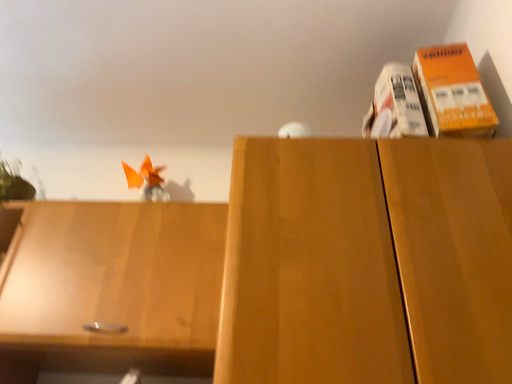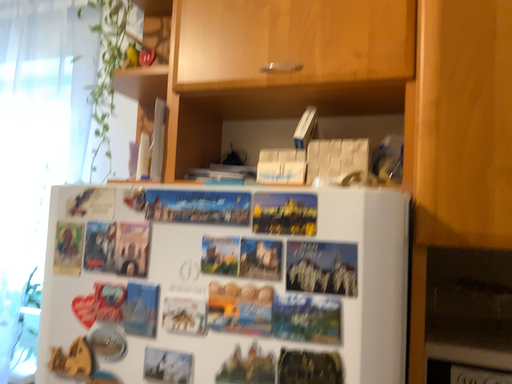
Question: How did the camera likely rotate when shooting the video?

Choices:
 (A) rotated downward
 (B) rotated upward

Answer: (A)